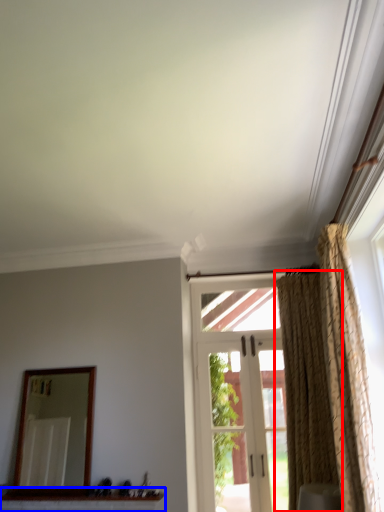
Question: Among these objects, which one is farthest to the camera, curtain (highlighted by a red box) or window sill (highlighted by a blue box)?

Choices:
 (A) curtain
 (B) window sill

Answer: (B)